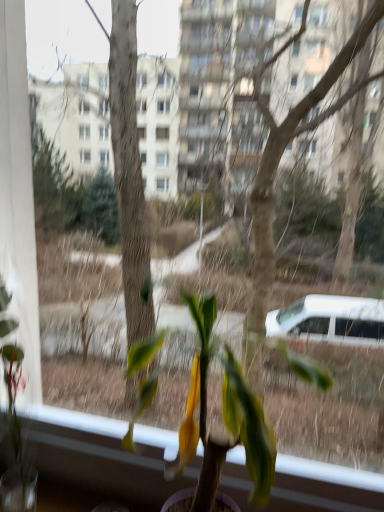
What do you see at coordinates (223, 418) in the screenshot?
I see `green matte plant at center, arranged as the 2th houseplant when viewed from the left` at bounding box center [223, 418].

This screenshot has height=512, width=384. I want to click on green matte plant at center, arranged as the 2th houseplant when viewed from the left, so pos(223,418).

In order to click on green matte plant at left, which ranks as the first houseplant in left-to-right order in this screenshot , I will do `click(16, 439)`.

Image resolution: width=384 pixels, height=512 pixels. What do you see at coordinates (16, 439) in the screenshot?
I see `green matte plant at left, which is counted as the 2th houseplant, starting from the right` at bounding box center [16, 439].

Find the location of a particular element. Image resolution: width=384 pixels, height=512 pixels. green matte plant at center, the 1th houseplant in the right-to-left sequence is located at coordinates (223, 418).

Considering the relative positions of green matte plant at center, arranged as the 2th houseplant when viewed from the left, and green matte plant at left, which ranks as the first houseplant in left-to-right order, in the image provided, is green matte plant at center, arranged as the 2th houseplant when viewed from the left, to the left or to the right of green matte plant at left, which ranks as the first houseplant in left-to-right order,?

Clearly, green matte plant at center, arranged as the 2th houseplant when viewed from the left, is on the right of green matte plant at left, which ranks as the first houseplant in left-to-right order, in the image.

In the scene shown: Which object is closer to the camera, green matte plant at center, arranged as the 2th houseplant when viewed from the left, or green matte plant at left, which ranks as the first houseplant in left-to-right order?

Positioned in front is green matte plant at center, arranged as the 2th houseplant when viewed from the left.

Is point (268, 449) less distant than point (22, 349)?

Yes, point (268, 449) is closer to viewer.

From the image's perspective, which is above, green matte plant at center, the 1th houseplant in the right-to-left sequence, or green matte plant at left, which ranks as the first houseplant in left-to-right order?

green matte plant at left, which ranks as the first houseplant in left-to-right order, from the image's perspective.

From a real-world perspective, which is physically below, green matte plant at center, the 1th houseplant in the right-to-left sequence, or green matte plant at left, which ranks as the first houseplant in left-to-right order?

green matte plant at left, which ranks as the first houseplant in left-to-right order, from a real-world perspective.

Considering the sizes of objects green matte plant at center, arranged as the 2th houseplant when viewed from the left, and green matte plant at left, which ranks as the first houseplant in left-to-right order, in the image provided, who is thinner, green matte plant at center, arranged as the 2th houseplant when viewed from the left, or green matte plant at left, which ranks as the first houseplant in left-to-right order,?

Thinner between the two is green matte plant at left, which ranks as the first houseplant in left-to-right order.

Considering the sizes of objects green matte plant at center, arranged as the 2th houseplant when viewed from the left, and green matte plant at left, which ranks as the first houseplant in left-to-right order, in the image provided, who is shorter, green matte plant at center, arranged as the 2th houseplant when viewed from the left, or green matte plant at left, which ranks as the first houseplant in left-to-right order,?

green matte plant at center, arranged as the 2th houseplant when viewed from the left, is shorter.

Is green matte plant at center, arranged as the 2th houseplant when viewed from the left, bigger or smaller than green matte plant at left, which ranks as the first houseplant in left-to-right order?

green matte plant at center, arranged as the 2th houseplant when viewed from the left, is bigger than green matte plant at left, which ranks as the first houseplant in left-to-right order.

Choose the correct answer: Is green matte plant at center, arranged as the 2th houseplant when viewed from the left, inside green matte plant at left, which is counted as the 2th houseplant, starting from the right, or outside it?

Result: green matte plant at center, arranged as the 2th houseplant when viewed from the left, is spatially situated outside green matte plant at left, which is counted as the 2th houseplant, starting from the right.

Would you say green matte plant at center, the 1th houseplant in the right-to-left sequence, is a long distance from green matte plant at left, which ranks as the first houseplant in left-to-right order?

Actually, green matte plant at center, the 1th houseplant in the right-to-left sequence, and green matte plant at left, which ranks as the first houseplant in left-to-right order, are a little close together.

Is green matte plant at left, which is counted as the 2th houseplant, starting from the right, at the back of green matte plant at center, arranged as the 2th houseplant when viewed from the left?

No.

What's the angular difference between green matte plant at center, the 1th houseplant in the right-to-left sequence, and green matte plant at left, which ranks as the first houseplant in left-to-right order,'s facing directions?

0.155 degrees separate the facing orientations of green matte plant at center, the 1th houseplant in the right-to-left sequence, and green matte plant at left, which ranks as the first houseplant in left-to-right order.

How far apart are green matte plant at center, the 1th houseplant in the right-to-left sequence, and green matte plant at left, which is counted as the 2th houseplant, starting from the right?

A distance of 13.84 inches exists between green matte plant at center, the 1th houseplant in the right-to-left sequence, and green matte plant at left, which is counted as the 2th houseplant, starting from the right.

Image resolution: width=384 pixels, height=512 pixels. What are the coordinates of `houseplant that appears on the left of green matte plant at center, the 1th houseplant in the right-to-left sequence` in the screenshot? It's located at (16, 439).

Considering the positions of objects green matte plant at left, which ranks as the first houseplant in left-to-right order, and green matte plant at center, the 1th houseplant in the right-to-left sequence, in the image provided, who is more to the left, green matte plant at left, which ranks as the first houseplant in left-to-right order, or green matte plant at center, the 1th houseplant in the right-to-left sequence,?

green matte plant at left, which ranks as the first houseplant in left-to-right order, is more to the left.

Which object is closer to the camera, green matte plant at left, which is counted as the 2th houseplant, starting from the right, or green matte plant at center, the 1th houseplant in the right-to-left sequence?

Positioned in front is green matte plant at center, the 1th houseplant in the right-to-left sequence.

Which point is more distant from viewer, (4, 311) or (206, 487)?

The point (4, 311) is farther.

From the image's perspective, which is above, green matte plant at left, which is counted as the 2th houseplant, starting from the right, or green matte plant at center, the 1th houseplant in the right-to-left sequence?

green matte plant at left, which is counted as the 2th houseplant, starting from the right.

From a real-world perspective, which is physically below, green matte plant at left, which ranks as the first houseplant in left-to-right order, or green matte plant at center, arranged as the 2th houseplant when viewed from the left?

green matte plant at left, which ranks as the first houseplant in left-to-right order, from a real-world perspective.

Considering the relative sizes of green matte plant at left, which ranks as the first houseplant in left-to-right order, and green matte plant at center, arranged as the 2th houseplant when viewed from the left, in the image provided, is green matte plant at left, which ranks as the first houseplant in left-to-right order, thinner than green matte plant at center, arranged as the 2th houseplant when viewed from the left,?

Indeed, green matte plant at left, which ranks as the first houseplant in left-to-right order, has a lesser width compared to green matte plant at center, arranged as the 2th houseplant when viewed from the left.

Between green matte plant at left, which is counted as the 2th houseplant, starting from the right, and green matte plant at center, arranged as the 2th houseplant when viewed from the left, which one has less height?

green matte plant at center, arranged as the 2th houseplant when viewed from the left.

Considering the sizes of objects green matte plant at left, which is counted as the 2th houseplant, starting from the right, and green matte plant at center, arranged as the 2th houseplant when viewed from the left, in the image provided, who is bigger, green matte plant at left, which is counted as the 2th houseplant, starting from the right, or green matte plant at center, arranged as the 2th houseplant when viewed from the left,?

Bigger between the two is green matte plant at center, arranged as the 2th houseplant when viewed from the left.

Is green matte plant at left, which is counted as the 2th houseplant, starting from the right, inside the boundaries of green matte plant at center, the 1th houseplant in the right-to-left sequence, or outside?

green matte plant at left, which is counted as the 2th houseplant, starting from the right, is outside green matte plant at center, the 1th houseplant in the right-to-left sequence.

Is green matte plant at left, which is counted as the 2th houseplant, starting from the right, next to green matte plant at center, arranged as the 2th houseplant when viewed from the left, and touching it?

green matte plant at left, which is counted as the 2th houseplant, starting from the right, is not next to green matte plant at center, arranged as the 2th houseplant when viewed from the left, and they're not touching.

Is green matte plant at left, which ranks as the first houseplant in left-to-right order, aimed at green matte plant at center, arranged as the 2th houseplant when viewed from the left?

No, green matte plant at left, which ranks as the first houseplant in left-to-right order, is not turned towards green matte plant at center, arranged as the 2th houseplant when viewed from the left.

Locate an element on the screen. This screenshot has height=512, width=384. houseplant that appears above the green matte plant at center, arranged as the 2th houseplant when viewed from the left (from the image's perspective) is located at coordinates (16, 439).

Where is `houseplant below the green matte plant at center, the 1th houseplant in the right-to-left sequence (from a real-world perspective)`? The image size is (384, 512). houseplant below the green matte plant at center, the 1th houseplant in the right-to-left sequence (from a real-world perspective) is located at coordinates (16, 439).

Locate an element on the screen. This screenshot has height=512, width=384. houseplant on the right of green matte plant at left, which is counted as the 2th houseplant, starting from the right is located at coordinates (223, 418).